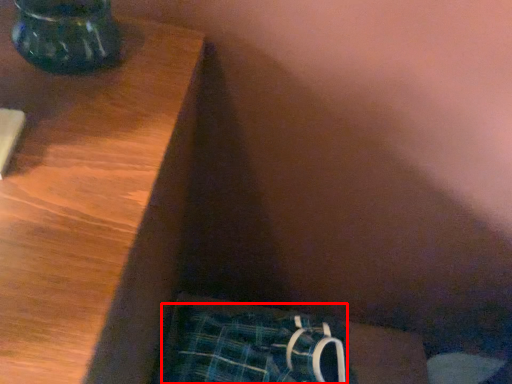
Question: Observing the image, what is the correct spatial positioning of underclothes (annotated by the red box) in reference to vase?

Choices:
 (A) left
 (B) right

Answer: (B)